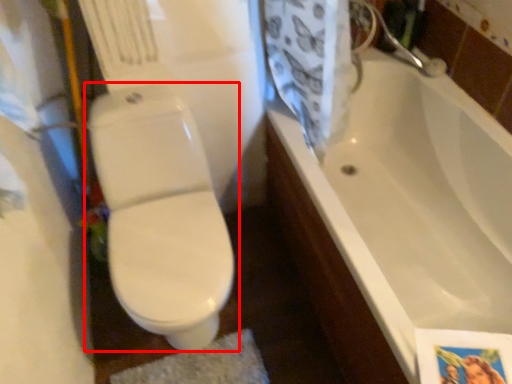
Question: From the image's perspective, where is toilet (annotated by the red box) located in relation to bathtub in the image?

Choices:
 (A) below
 (B) above

Answer: (A)